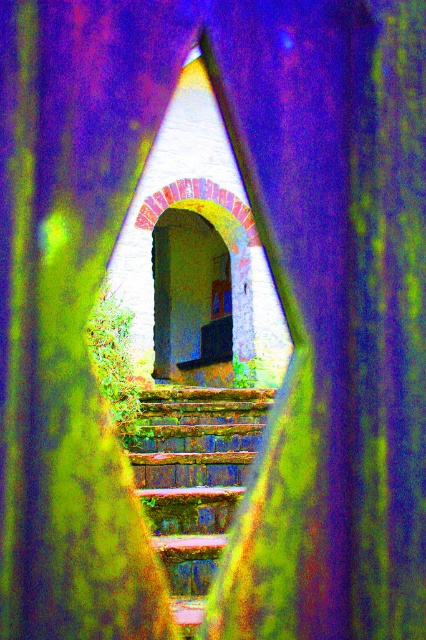
You are standing at the entrance of the building and want to go down the stairs. Which direction should you face to see the rusty metal stairs at center?

Since the rusty metal stairs at center are located at point coordinates of (193, 480), you should face towards the center of the image to see them.

You are a painter standing in front of the triangular opening. You want to paint the rusty metal stairs at center and the matte wood balustrade at center. Which object is located to the left of the other?

The rusty metal stairs at center is positioned on the left side of matte wood balustrade at center.